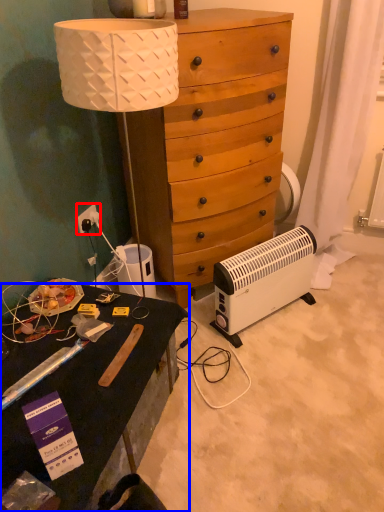
Question: Which of the following is the farthest to the observer, power outlet (highlighted by a red box) or desk (highlighted by a blue box)?

Choices:
 (A) power outlet
 (B) desk

Answer: (A)